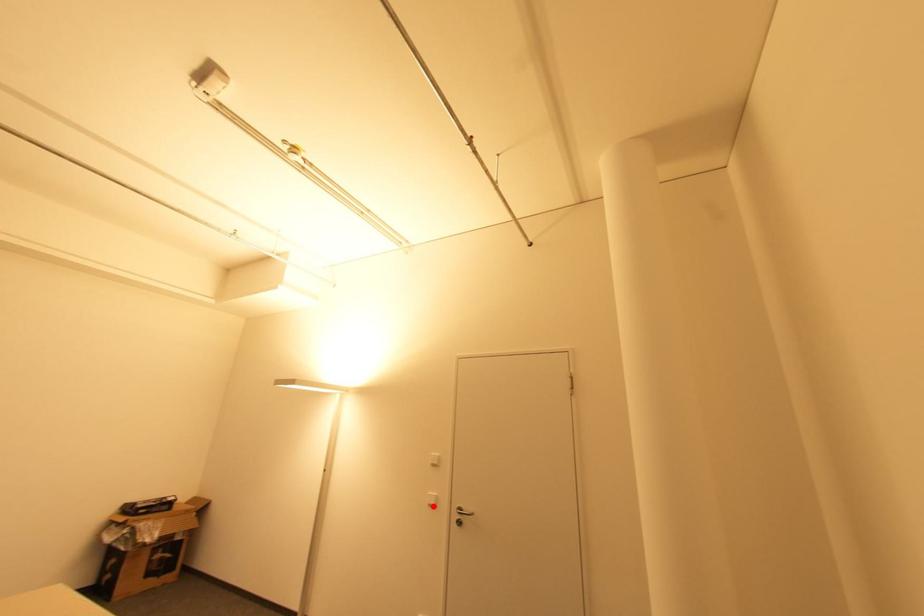
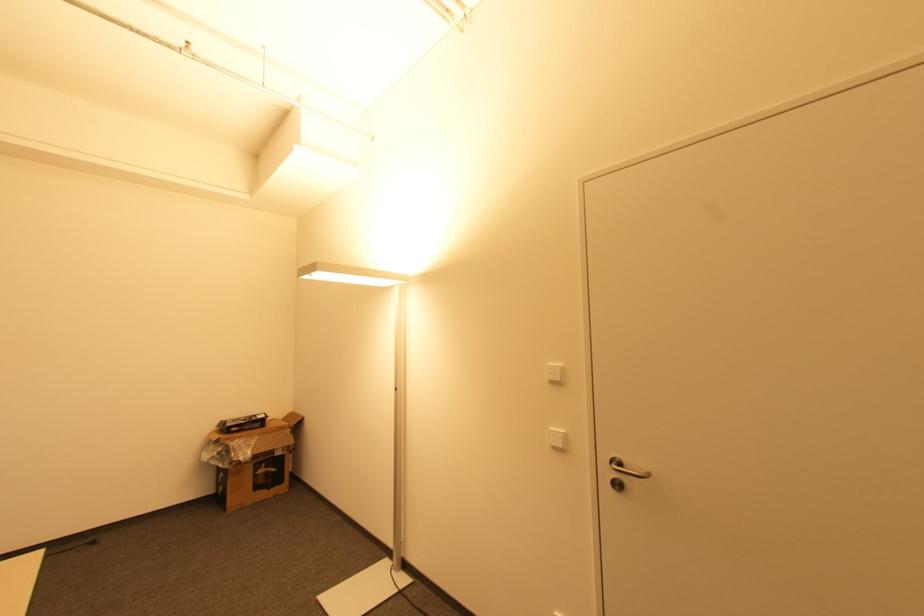
Locate, in the second image, the point that corresponds to the highlighted location in the first image.

(557, 448)